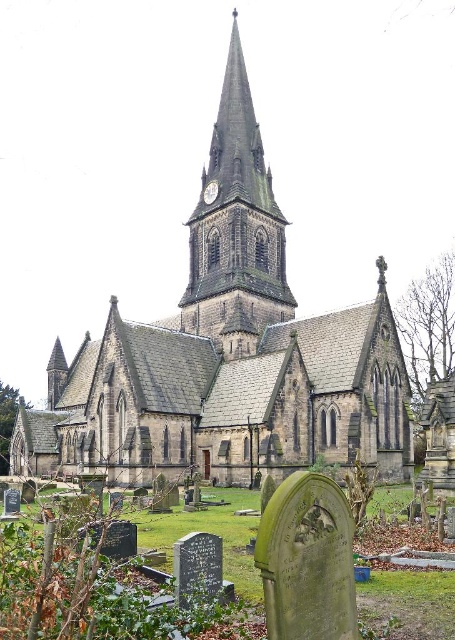
Is point (222, 234) positioned behind point (239, 115)?

No, it is in front of (239, 115).

Is dark gray stone church at center to the right of dark gray stone clock tower at center from the viewer's perspective?

Incorrect, dark gray stone church at center is not on the right side of dark gray stone clock tower at center.

Find the location of `dark gray stone church at center`. dark gray stone church at center is located at coordinates (227, 355).

Which of these two, dark gray stone church at center or metallic clock at center, stands taller?

With more height is dark gray stone church at center.

Can you confirm if dark gray stone church at center is shorter than metallic clock at center?

In fact, dark gray stone church at center may be taller than metallic clock at center.

Between point (126, 372) and point (212, 182), which one is positioned behind?

Positioned behind is point (212, 182).

Where is `dark gray stone church at center`? dark gray stone church at center is located at coordinates (227, 355).

Does point (217, 118) lie behind point (213, 184)?

Yes, it is.

Which is behind, point (198, 280) or point (207, 204)?

The point (207, 204) is behind.

Between point (282, 280) and point (207, 192), which one is positioned behind?

Positioned behind is point (207, 192).

This screenshot has height=640, width=455. I want to click on dark gray stone clock tower at center, so click(236, 224).